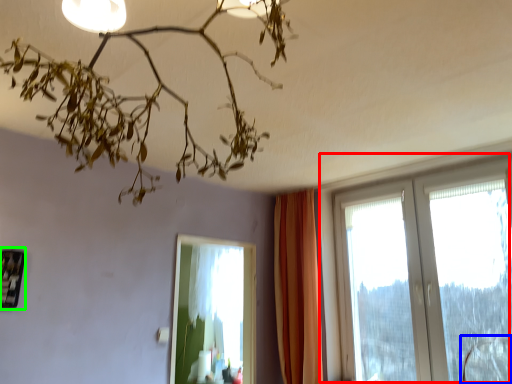
Question: Which object is the farthest from window (highlighted by a red box)? Choose among these: swivel chair (highlighted by a blue box) or picture frame (highlighted by a green box).

Choices:
 (A) swivel chair
 (B) picture frame

Answer: (B)